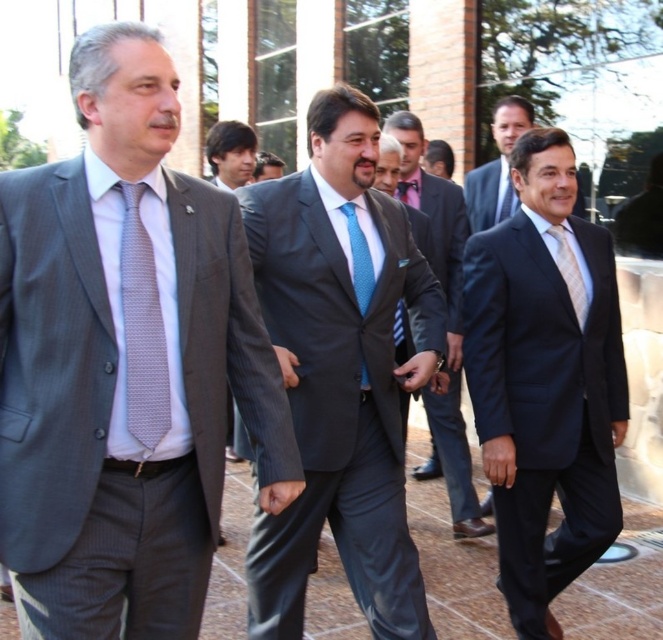
Is point (233, 148) behind point (349, 234)?

That is True.

Between point (241, 180) and point (361, 269), which one is positioned in front?

Point (361, 269)

Where is `brown hair at center`? Image resolution: width=663 pixels, height=640 pixels. brown hair at center is located at coordinates (229, 152).

Does blue textured suit at center come behind light blue silk tie at center?

Yes, blue textured suit at center is behind light blue silk tie at center.

What do you see at coordinates (267, 166) in the screenshot?
I see `blue textured suit at center` at bounding box center [267, 166].

Measure the distance between blue textured suit at center and camera.

A distance of 4.95 meters exists between blue textured suit at center and camera.

The height and width of the screenshot is (640, 663). What are the coordinates of `blue textured suit at center` in the screenshot? It's located at (267, 166).

Between blue dotted tie at center and white silk tie at center, which one appears on the right side from the viewer's perspective?

white silk tie at center is more to the right.

Between point (369, 264) and point (548, 232), which one is positioned in front?

Point (369, 264) is more forward.

The image size is (663, 640). Find the location of `blue dotted tie at center`. blue dotted tie at center is located at coordinates (357, 259).